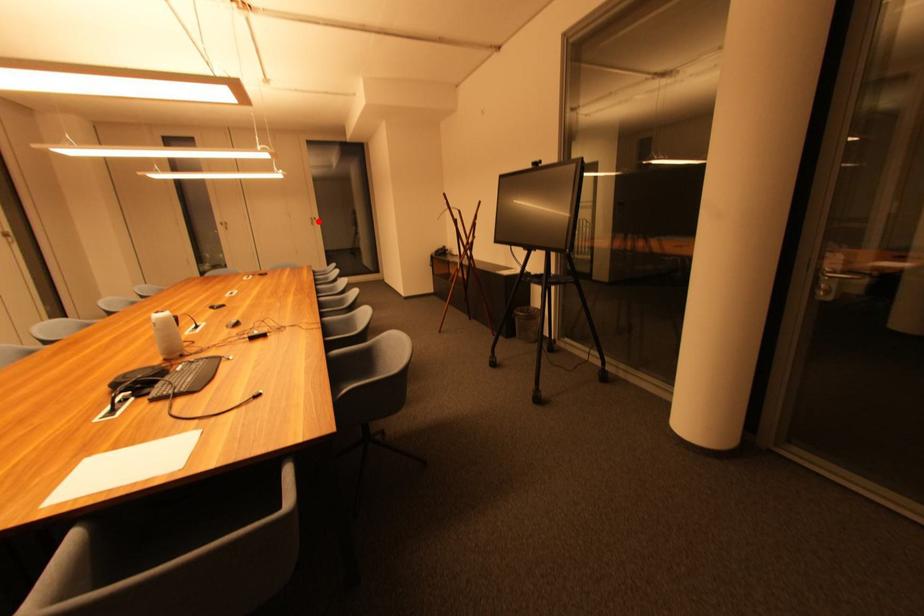
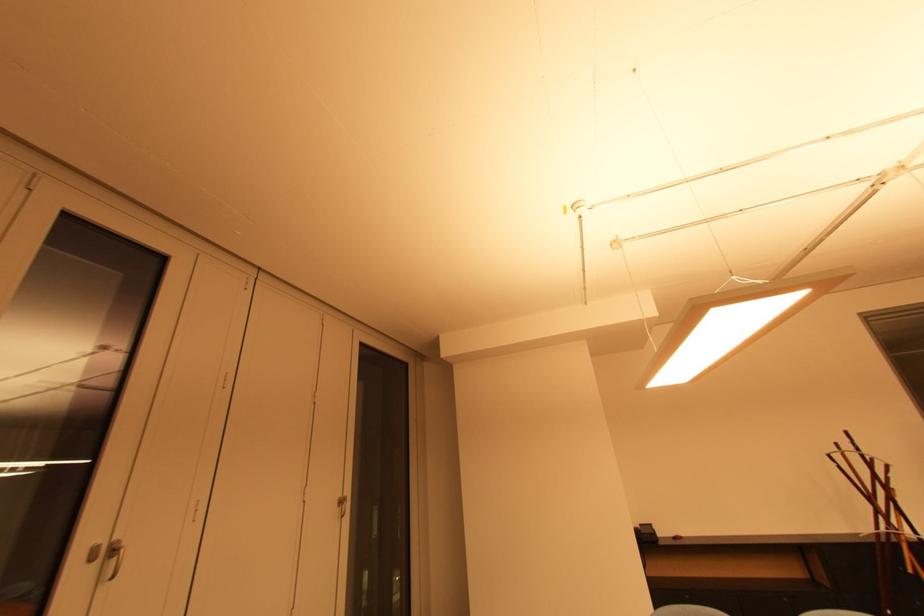
Find the pixel in the second image that matches the highlighted location in the first image.

(346, 504)